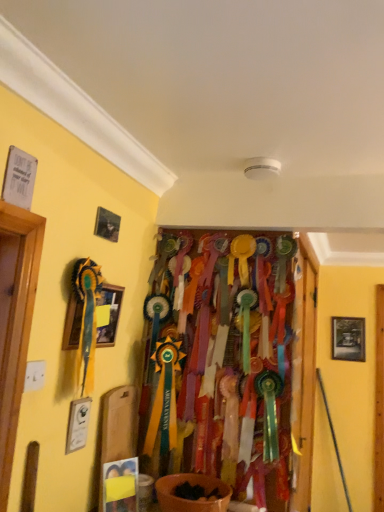
Question: Is wooden framed picture at left, the second picture frame from the right, not close to wooden door at center?

Choices:
 (A) no
 (B) yes

Answer: (A)

Question: From the image's perspective, does wooden framed picture at left, arranged as the second picture frame when viewed from the back, appear lower than wooden door at center?

Choices:
 (A) no
 (B) yes

Answer: (A)

Question: From a real-world perspective, is wooden framed picture at left, marked as the 1th picture frame in a left-to-right arrangement, physically below wooden door at center?

Choices:
 (A) yes
 (B) no

Answer: (B)

Question: Does wooden framed picture at left, which appears as the 1th picture frame when viewed from the front, have a greater width compared to wooden door at center?

Choices:
 (A) yes
 (B) no

Answer: (B)

Question: Is wooden framed picture at left, marked as the 1th picture frame in a left-to-right arrangement, positioned beyond the bounds of wooden door at center?

Choices:
 (A) no
 (B) yes

Answer: (B)

Question: Would you say wooden framed picture at left, the second picture frame from the right, is inside or outside wooden framed picture at right, the first picture frame from the back?

Choices:
 (A) inside
 (B) outside

Answer: (B)

Question: Is point (107, 294) closer or farther from the camera than point (357, 332)?

Choices:
 (A) farther
 (B) closer

Answer: (B)

Question: Looking at the image, does wooden framed picture at left, the second picture frame from the right, seem bigger or smaller compared to wooden framed picture at right, which is the second picture frame in front-to-back order?

Choices:
 (A) big
 (B) small

Answer: (A)

Question: From a real-world perspective, is wooden framed picture at left, positioned as the second picture frame in bottom-to-top order, physically located above or below wooden framed picture at right, marked as the 1th picture frame in a bottom-to-top arrangement?

Choices:
 (A) below
 (B) above

Answer: (B)

Question: In the image, is wooden door at center positioned in front of or behind wooden framed picture at left, marked as the 1th picture frame in a left-to-right arrangement?

Choices:
 (A) behind
 (B) front

Answer: (A)

Question: From the image's perspective, is wooden door at center located above or below wooden framed picture at left, positioned as the second picture frame in bottom-to-top order?

Choices:
 (A) below
 (B) above

Answer: (A)

Question: Considering the positions of wooden door at center and wooden framed picture at left, the 1th picture frame in the top-to-bottom sequence, in the image, is wooden door at center bigger or smaller than wooden framed picture at left, the 1th picture frame in the top-to-bottom sequence,?

Choices:
 (A) big
 (B) small

Answer: (A)

Question: Is wooden door at center taller or shorter than wooden framed picture at left, marked as the 1th picture frame in a left-to-right arrangement?

Choices:
 (A) tall
 (B) short

Answer: (A)

Question: Visually, is wooden framed picture at left, positioned as the second picture frame in bottom-to-top order, positioned to the left or to the right of wooden door at center?

Choices:
 (A) left
 (B) right

Answer: (A)

Question: In terms of width, does wooden framed picture at left, marked as the 1th picture frame in a left-to-right arrangement, look wider or thinner when compared to wooden door at center?

Choices:
 (A) wide
 (B) thin

Answer: (B)